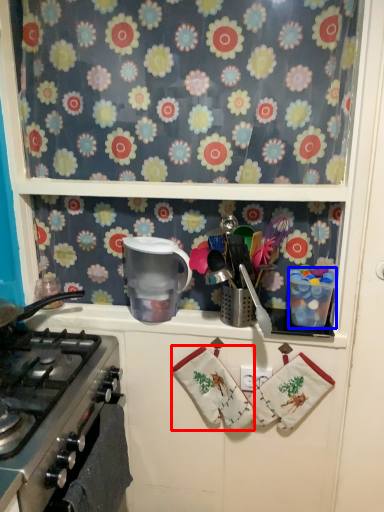
Question: Which of the following is the closest to the observer, hand towel (highlighted by a red box) or appliance (highlighted by a blue box)?

Choices:
 (A) hand towel
 (B) appliance

Answer: (B)